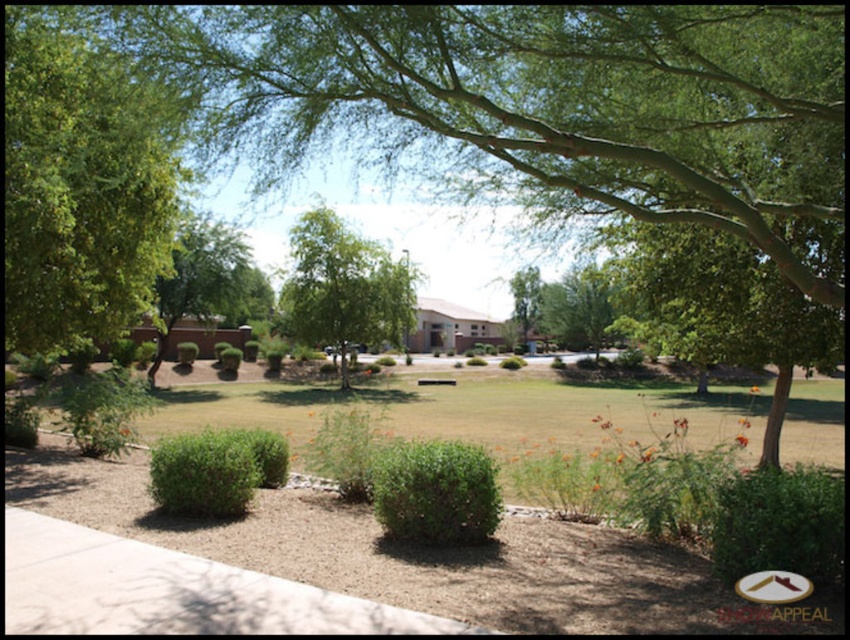
In the scene shown: You are a gardener assessing the plants in this outdoor area. Which of the two plants, the green leafy tree at center or the green leafy bush at center, would require more vertical space for proper growth?

The green leafy tree at center requires more vertical space because it has a greater height compared to the green leafy bush at center.

You are a landscape architect designing a new garden layout. You need to place a statue between the green leafy tree at upper left and the green leafy tree at left. Based on their heights, which tree should the statue be closer to for visual balance?

The green leafy tree at upper left is taller than the green leafy tree at left, so the statue should be placed closer to the shorter green leafy tree at left to achieve visual balance.

You are standing at the center of the paved pathway in the image. You see two points marked on the ground. The first point is at point (466,97), and the second point is at point (99,304). Which point is closer to you?

Point (466,97) is closer to the viewer than point (99,304).